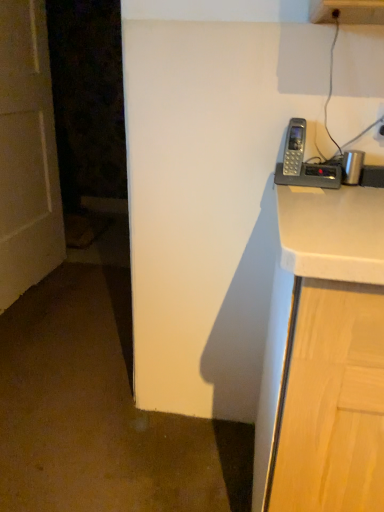
Question: Considering the positions of white plastic electric outlet at upper right and gray plastic phone at upper right in the image, is white plastic electric outlet at upper right taller or shorter than gray plastic phone at upper right?

Choices:
 (A) short
 (B) tall

Answer: (A)

Question: Is white plastic electric outlet at upper right wider or thinner than gray plastic phone at upper right?

Choices:
 (A) thin
 (B) wide

Answer: (A)

Question: Which is farther from the white plastic electric outlet at upper right?

Choices:
 (A) gray plastic phone at upper right
 (B) white matte door at left

Answer: (B)

Question: Which of these objects is positioned farthest from the white plastic electric outlet at upper right?

Choices:
 (A) white matte door at left
 (B) gray plastic phone at upper right

Answer: (A)